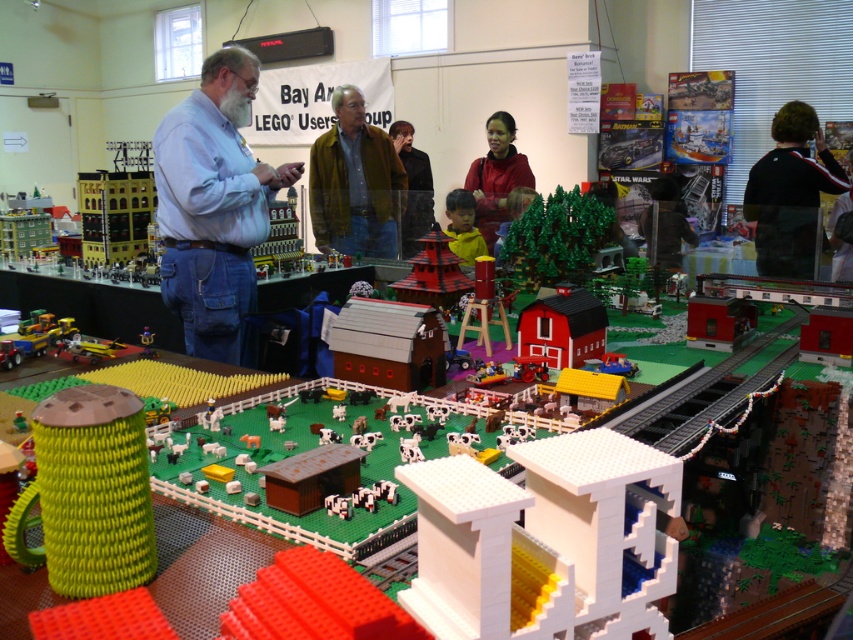
You are at a cozy coffee shop and see a green woven mug at center and a brown woolen sweater at center. Which item is placed higher?

The brown woolen sweater at center is placed higher than the green woven mug at center.

You are a photographer positioned at the back of the room. You want to take a photo of the yellow matte shirt at center without the brown leather jacket at center blocking it. What should you do?

The yellow matte shirt at center is behind the brown leather jacket at center, so you should move to a position where you can see behind the brown leather jacket at center to capture the yellow matte shirt at center without obstruction.

You are a photographer standing at the point marked as point (413, 188). You want to take a photo of the LEGO farm setup in the foreground. Is there any obstruction between your position and the LEGO farm setup?

The point (413, 188) is on brown leather jacket at center, so there is an obstruction between your position and the LEGO farm setup.